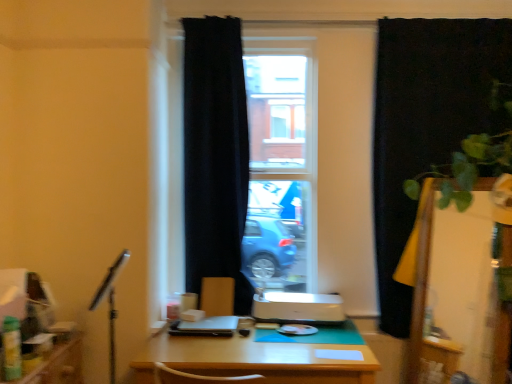
Image resolution: width=512 pixels, height=384 pixels. In order to click on transparent glass screen door at right in this screenshot , I will do `click(458, 290)`.

Locate an element on the screen. wooden desk at center is located at coordinates (260, 359).

Image resolution: width=512 pixels, height=384 pixels. Describe the element at coordinates (215, 155) in the screenshot. I see `black fabric curtain at center, which is counted as the 1th curtain, starting from the left` at that location.

Measure the distance between green leafy plant at right and camera.

The distance of green leafy plant at right from camera is 6.92 feet.

Describe the element at coordinates (206, 327) in the screenshot. The height and width of the screenshot is (384, 512). I see `satin black laptop at center` at that location.

Describe the element at coordinates (217, 296) in the screenshot. I see `matte brown armchair at center` at that location.

What do you see at coordinates (336, 144) in the screenshot? I see `transparent glass window at center` at bounding box center [336, 144].

I want to click on transparent glass screen door at right, so click(458, 290).

Does black matte curtain at right, the 1th curtain from the right, have a lesser width compared to transparent glass screen door at right?

Correct, the width of black matte curtain at right, the 1th curtain from the right, is less than that of transparent glass screen door at right.

Consider the image. Is the position of black matte curtain at right, the 1th curtain from the right, more distant than that of transparent glass screen door at right?

Yes, the depth of black matte curtain at right, the 1th curtain from the right, is greater than that of transparent glass screen door at right.

From a real-world perspective, which object stands above the other?

In real-world perspective, black matte curtain at right, the 1th curtain from the right, is above.

Is black matte curtain at right, arranged as the 2th curtain when viewed from the left, facing towards transparent glass screen door at right?

Yes, black matte curtain at right, arranged as the 2th curtain when viewed from the left, is turned towards transparent glass screen door at right.

In terms of width, does black matte curtain at right, the 1th curtain from the right, look wider or thinner when compared to matte brown armchair at center?

Clearly, black matte curtain at right, the 1th curtain from the right, has more width compared to matte brown armchair at center.

Does black matte curtain at right, arranged as the 2th curtain when viewed from the left, touch matte brown armchair at center?

No, black matte curtain at right, arranged as the 2th curtain when viewed from the left, is not beside matte brown armchair at center.

Is black matte curtain at right, arranged as the 2th curtain when viewed from the left, turned away from matte brown armchair at center?

No, black matte curtain at right, arranged as the 2th curtain when viewed from the left, is not facing the opposite direction of matte brown armchair at center.

Between point (185, 119) and point (311, 101), which one is positioned behind?

The point (311, 101) is behind.

How many degrees apart are the facing directions of black fabric curtain at center, which is counted as the 1th curtain, starting from the left, and transparent glass window at center?

There is a 0.191-degree angle between the facing directions of black fabric curtain at center, which is counted as the 1th curtain, starting from the left, and transparent glass window at center.

Who is taller, black fabric curtain at center, which is the 2th curtain from right to left, or transparent glass window at center?

black fabric curtain at center, which is the 2th curtain from right to left.

Is black fabric curtain at center, which is counted as the 1th curtain, starting from the left, aimed at transparent glass window at center?

Yes.

Considering the relative positions of black fabric curtain at center, which is the 2th curtain from right to left, and satin black laptop at center in the image provided, is black fabric curtain at center, which is the 2th curtain from right to left, in front of satin black laptop at center?

No, black fabric curtain at center, which is the 2th curtain from right to left, is further to the viewer.

From the image's perspective, between black fabric curtain at center, which is the 2th curtain from right to left, and satin black laptop at center, which one is located above?

black fabric curtain at center, which is the 2th curtain from right to left, appears higher in the image.

Based on the photo, does black fabric curtain at center, which is the 2th curtain from right to left, have a greater width compared to satin black laptop at center?

In fact, black fabric curtain at center, which is the 2th curtain from right to left, might be narrower than satin black laptop at center.

From a real-world perspective, is black fabric curtain at center, which is counted as the 1th curtain, starting from the left, positioned above or below satin black laptop at center?

black fabric curtain at center, which is counted as the 1th curtain, starting from the left, is situated higher than satin black laptop at center in the real world.

Is wooden desk at center beside transparent glass screen door at right?

No.

Is wooden desk at center oriented towards transparent glass screen door at right?

No.

Which is in front, point (330, 380) or point (488, 307)?

The point (330, 380) is in front.

From the image's perspective, is wooden desk at center on top of transparent glass screen door at right?

No, from the image's perspective, wooden desk at center is not above transparent glass screen door at right.

This screenshot has height=384, width=512. I want to click on laptop behind the transparent glass screen door at right, so click(x=206, y=327).

Is satin black laptop at center not near transparent glass screen door at right?

Absolutely, satin black laptop at center is distant from transparent glass screen door at right.

From a real-world perspective, who is located lower, satin black laptop at center or transparent glass screen door at right?

satin black laptop at center, from a real-world perspective.

Is satin black laptop at center in front of transparent glass screen door at right?

No.

Between satin black laptop at center and wooden desk at center, which one has more height?

With more height is wooden desk at center.

Is satin black laptop at center positioned in front of wooden desk at center?

No, the depth of satin black laptop at center is greater than that of wooden desk at center.

What's the angular difference between satin black laptop at center and wooden desk at center's facing directions?

They differ by 0.0461 degrees in their facing directions.

Considering the points (233, 319) and (227, 343), which point is behind, point (233, 319) or point (227, 343)?

The point (233, 319) is behind.

The height and width of the screenshot is (384, 512). I want to click on screen door beneath the black matte curtain at right, arranged as the 2th curtain when viewed from the left (from a real-world perspective), so click(458, 290).

This screenshot has height=384, width=512. Identify the location of the 1st curtain directly above the matte brown armchair at center (from a real-world perspective). (425, 124).

When comparing their distances from black fabric curtain at center, which is counted as the 1th curtain, starting from the left, does matte brown armchair at center or satin black laptop at center seem closer?

matte brown armchair at center lies closer to black fabric curtain at center, which is counted as the 1th curtain, starting from the left, than the other object.

Which object lies further to the anchor point white glossy printer at center, transparent glass window at center or transparent glass screen door at right?

The object further to white glossy printer at center is transparent glass screen door at right.

Considering their positions, is black matte curtain at right, the 1th curtain from the right, positioned further to transparent glass window at center than green leafy plant at right?

green leafy plant at right is positioned further to the anchor transparent glass window at center.

From the image, which object appears to be farther from satin black laptop at center, matte brown armchair at center or transparent glass window at center?

transparent glass window at center is further to satin black laptop at center.

Based on their spatial positions, is white glossy printer at center or black fabric curtain at center, which is counted as the 1th curtain, starting from the left, further from black matte curtain at right, arranged as the 2th curtain when viewed from the left?

black fabric curtain at center, which is counted as the 1th curtain, starting from the left, is positioned further to the anchor black matte curtain at right, arranged as the 2th curtain when viewed from the left.

Estimate the real-world distances between objects in this image. Which object is closer to white glossy printer at center, transparent glass screen door at right or matte brown armchair at center?

matte brown armchair at center is positioned closer to the anchor white glossy printer at center.

Based on their spatial positions, is transparent glass window at center or matte brown armchair at center closer to black fabric curtain at center, which is counted as the 1th curtain, starting from the left?

transparent glass window at center is positioned closer to the anchor black fabric curtain at center, which is counted as the 1th curtain, starting from the left.

When comparing their distances from black fabric curtain at center, which is counted as the 1th curtain, starting from the left, does wooden desk at center or green leafy plant at right seem closer?

Based on the image, wooden desk at center appears to be nearer to black fabric curtain at center, which is counted as the 1th curtain, starting from the left.

Image resolution: width=512 pixels, height=384 pixels. What are the coordinates of `desk situated between matte brown armchair at center and black matte curtain at right, arranged as the 2th curtain when viewed from the left, from left to right` in the screenshot? It's located at (260, 359).

Find the location of a particular element. Image resolution: width=512 pixels, height=384 pixels. armchair between satin black laptop at center and black matte curtain at right, arranged as the 2th curtain when viewed from the left is located at coordinates (217, 296).

The width and height of the screenshot is (512, 384). What are the coordinates of `printer between transparent glass window at center and green leafy plant at right` in the screenshot? It's located at (297, 308).

Locate an element on the screen. The width and height of the screenshot is (512, 384). curtain located between satin black laptop at center and black matte curtain at right, the 1th curtain from the right, in the left-right direction is located at coordinates (215, 155).